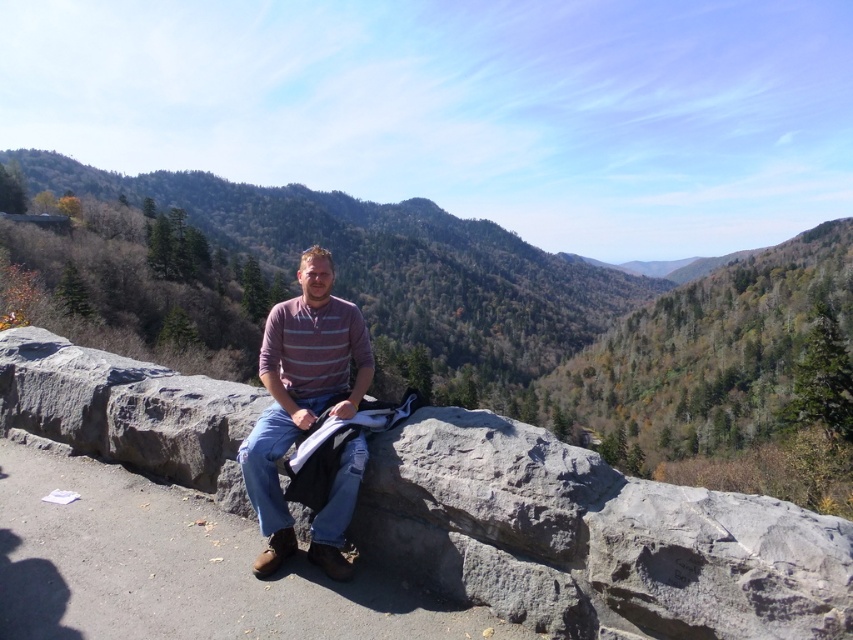
Is gray rough stone at center shorter than striped cotton shirt at center?

Correct, gray rough stone at center is not as tall as striped cotton shirt at center.

Which is more to the right, gray rough stone at center or striped cotton shirt at center?

gray rough stone at center is more to the right.

This screenshot has height=640, width=853. What do you see at coordinates (593, 538) in the screenshot?
I see `gray rough stone at center` at bounding box center [593, 538].

Locate an element on the screen. Image resolution: width=853 pixels, height=640 pixels. gray rough stone at center is located at coordinates (593, 538).